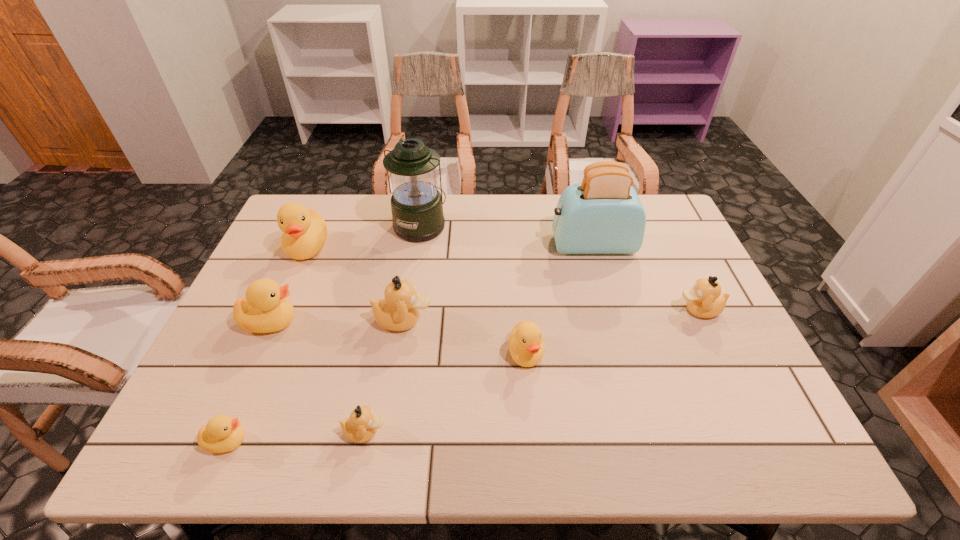
Select which duckling is the second closest to the green lantern. Please provide its 2D coordinates. Your answer should be formatted as a tuple, i.e. [(x, y)], where the tuple contains the x and y coordinates of a point satisfying the conditions above.

[(399, 310)]

Where is `the third closest yellow duckling to the second biggest yellow duckling`? The image size is (960, 540). the third closest yellow duckling to the second biggest yellow duckling is located at coordinates (526, 345).

Select which yellow duckling appears as the second closest to the biggest tan duckling. Please provide its 2D coordinates. Your answer should be formatted as a tuple, i.e. [(x, y)], where the tuple contains the x and y coordinates of a point satisfying the conditions above.

[(526, 345)]

Identify the location of the second closest tan duckling relative to the smallest yellow duckling. (399, 310).

Find the location of `the second closest tan duckling to the third biggest yellow duckling`. the second closest tan duckling to the third biggest yellow duckling is located at coordinates (361, 426).

In order to click on vacant space that satisfies the following two spatial constraints: 1. on the side of the eighth object from left to right with the lever; 2. on the face of the sixth duckling from left to right in this screenshot , I will do `click(622, 353)`.

In order to click on vacant space that satisfies the following two spatial constraints: 1. on the side of the eighth object from left to right with the lever; 2. on the face of the second duckling from right to left in this screenshot , I will do pos(622,353).

I want to click on free spot that satisfies the following two spatial constraints: 1. on the front side of the lantern; 2. on the face of the biggest tan duckling, so click(406, 320).